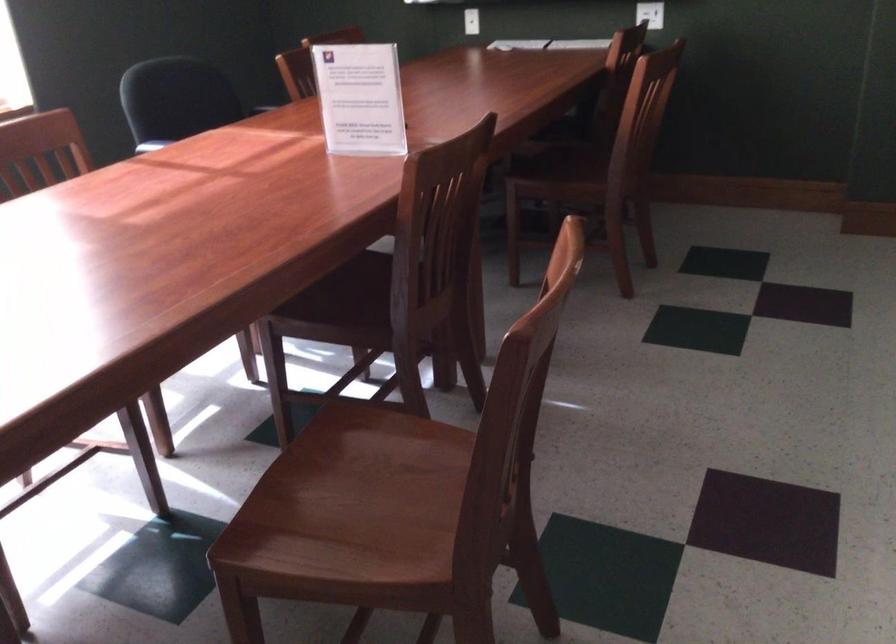
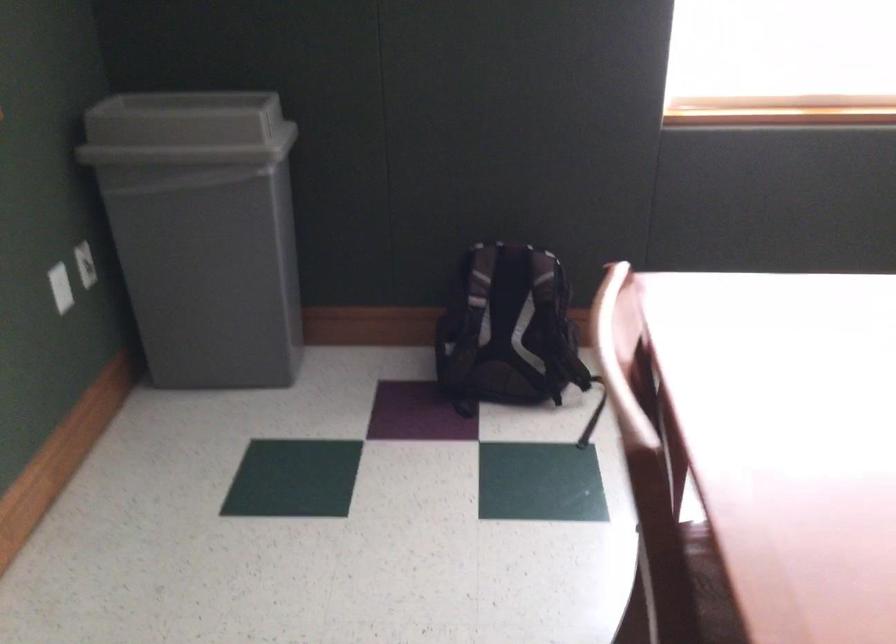
First-person continuous shooting, in which direction is the camera rotating?

The rotation direction of the camera is left-down.